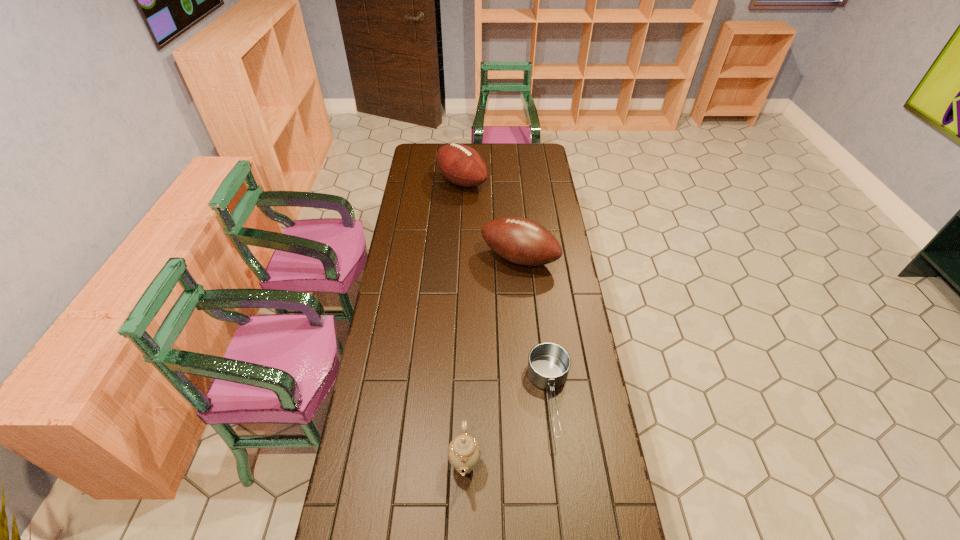
Identify the location of unoccupied position between the third nearest object and the saucepan. (535, 328).

I want to click on free spot between the shortest object and the second shortest object, so click(508, 430).

At what (x,y) coordinates should I click in order to perform the action: click on empty location between the shortest object and the third nearest object. Please return your answer as a coordinate pair (x, y). This screenshot has height=540, width=960. Looking at the image, I should click on (535, 328).

Locate an element on the screen. vacant space in between the saucepan and the farther football (American) is located at coordinates (506, 289).

Locate an element on the screen. unoccupied position between the shortest object and the farthest object is located at coordinates (506, 289).

Find the location of a particular element. The width and height of the screenshot is (960, 540). unoccupied area between the nearer football (American) and the saucepan is located at coordinates (535, 328).

I want to click on object that is the second closest to the second farthest object, so click(x=548, y=363).

Choose which object is the third nearest neighbor to the third nearest object. Please provide its 2D coordinates. Your answer should be formatted as a tuple, i.e. [(x, y)], where the tuple contains the x and y coordinates of a point satisfying the conditions above.

[(464, 452)]

Find the location of a particular element. vacant space that satisfies the following two spatial constraints: 1. on the front side of the second farthest object; 2. on the spout of the third tallest object is located at coordinates 538,464.

Where is `free spot that satisfies the following two spatial constraints: 1. on the front side of the nearer football (American); 2. on the spout of the second shortest object`? This screenshot has height=540, width=960. free spot that satisfies the following two spatial constraints: 1. on the front side of the nearer football (American); 2. on the spout of the second shortest object is located at coordinates (538, 464).